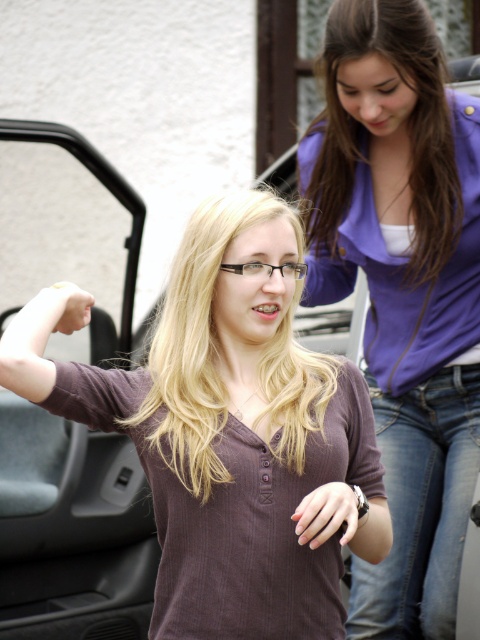
From the picture: You are trying to place a small object between the jeans at lower right and the matte skin hand at lower left. Based on their positions, do you think there will be enough space?

The jeans at lower right might be wider than matte skin hand at lower left, so there may not be enough space for the small object between them.

In the scene shown: You are a photographer trying to capture a candid shot of the two people in the scene. You need to ensure that the matte brown shirt at center and the matte skin hand at lower left are both visible in the frame. Based on their positions, will the hand be visible above the shirt or below it?

The matte brown shirt at center is below the matte skin hand at lower left, so the hand will be visible above the shirt in the photo.

In the scene shown: You are designing a poster and need to know which object in the image is wider. You see the matte brown shirt at center and the matte skin hand at lower left. Which one has a greater width?

The matte brown shirt at center has a greater width than the matte skin hand at lower left according to the description.